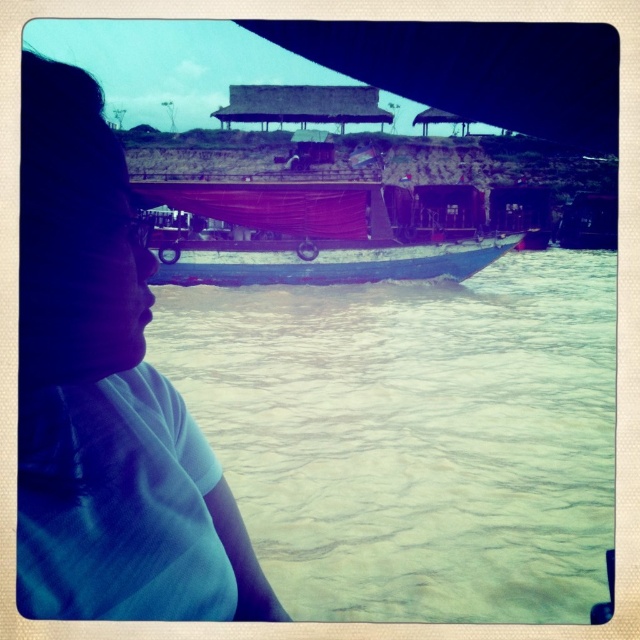
Is white matte shirt at left positioned in front of wooden boat at center?

Yes, white matte shirt at left is in front of wooden boat at center.

Between white matte shirt at left and wooden boat at center, which one is positioned lower?

white matte shirt at left is lower down.

Is point (99, 387) less distant than point (467, 276)?

Yes, point (99, 387) is in front of point (467, 276).

I want to click on white matte shirt at left, so click(x=106, y=397).

Does greenish murky water at center have a larger size compared to white matte shirt at left?

Correct, greenish murky water at center is larger in size than white matte shirt at left.

Identify the location of greenish murky water at center. This screenshot has height=640, width=640. (413, 435).

Find the location of a particular element. greenish murky water at center is located at coordinates click(x=413, y=435).

Between greenish murky water at center and wooden boat at center, which one has more height?

greenish murky water at center

Does point (554, 300) come in front of point (410, 236)?

No, it is behind (410, 236).

You are a GUI agent. You are given a task and a screenshot of the screen. Output one action in this format:
    pyautogui.click(x=<x>, y=<y>)
    Task: Click on the greenish murky water at center
    Image resolution: width=640 pixels, height=640 pixels.
    Given the screenshot: What is the action you would take?
    pyautogui.click(x=413, y=435)